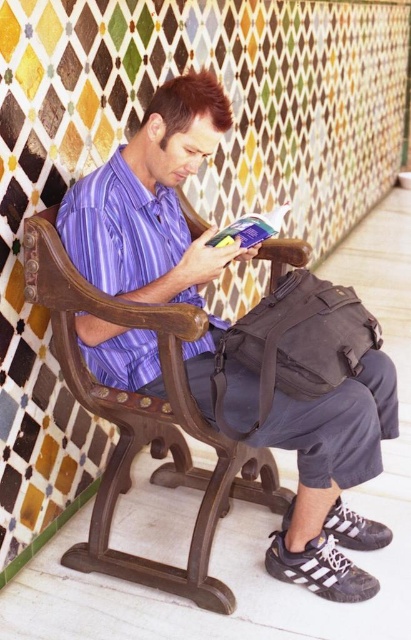
Which of these two, purple striped shirt at center or purple satin shirt at center, stands taller?

With more height is purple striped shirt at center.

Who is more distant from viewer, (157, 93) or (83, 275)?

Positioned behind is point (157, 93).

Find the location of a particular element. This screenshot has height=640, width=411. purple striped shirt at center is located at coordinates (152, 202).

Is purple satin shirt at center shorter than hardcover book at center?

No.

Does purple satin shirt at center appear over hardcover book at center?

Actually, purple satin shirt at center is below hardcover book at center.

Identify the location of purple satin shirt at center. The height and width of the screenshot is (640, 411). (120, 228).

Is point (69, 218) positioned in front of point (270, 236)?

Yes, point (69, 218) is closer to viewer.

Which is above, purple striped shirt at center or hardcover book at center?

hardcover book at center

What do you see at coordinates (152, 202) in the screenshot? I see `purple striped shirt at center` at bounding box center [152, 202].

Where is `purple striped shirt at center`? The image size is (411, 640). purple striped shirt at center is located at coordinates (152, 202).